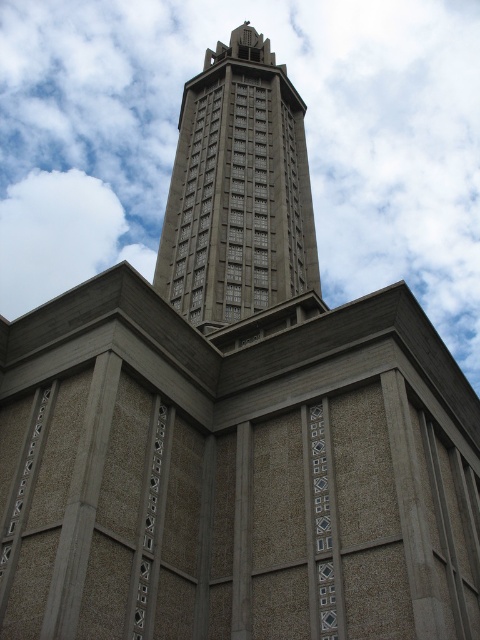
Question: Does white fluffy cloud at upper center have a larger size compared to gray stone tower at center?

Choices:
 (A) yes
 (B) no

Answer: (A)

Question: Which of the following is the closest to the observer?

Choices:
 (A) (308, 211)
 (B) (437, 236)

Answer: (A)

Question: Considering the relative positions of white fluffy cloud at upper center and gray stone tower at center in the image provided, where is white fluffy cloud at upper center located with respect to gray stone tower at center?

Choices:
 (A) left
 (B) right

Answer: (B)

Question: Where is white fluffy cloud at upper center located in relation to gray stone tower at center in the image?

Choices:
 (A) below
 (B) above

Answer: (B)

Question: Which of the following is the farthest from the observer?

Choices:
 (A) (225, 97)
 (B) (475, 129)

Answer: (B)